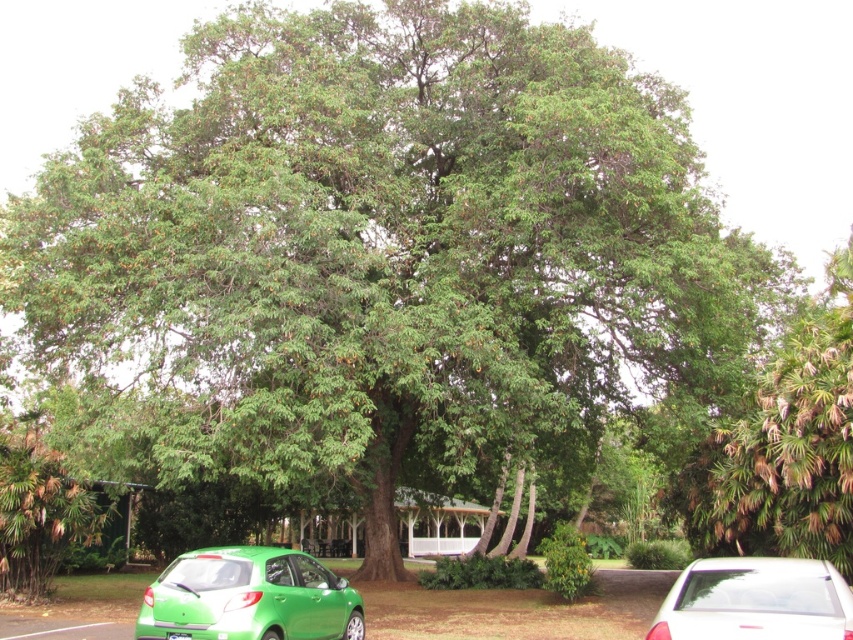
Question: Can you confirm if white glossy sedan at lower right is thinner than green plastic license plate at lower center?

Choices:
 (A) yes
 (B) no

Answer: (B)

Question: Estimate the real-world distances between objects in this image. Which object is farther from the green matte hatchback at lower left?

Choices:
 (A) white glossy sedan at lower right
 (B) green leafy tree at right
 (C) green plastic license plate at lower center
 (D) green leafy tree at lower left

Answer: (B)

Question: Among these objects, which one is nearest to the camera?

Choices:
 (A) green leafy tree at right
 (B) green leafy tree at lower left
 (C) green plastic license plate at lower center

Answer: (C)

Question: Which is nearer to the green leafy tree at lower left?

Choices:
 (A) white glossy sedan at lower right
 (B) green matte hatchback at lower left

Answer: (B)

Question: Is green matte hatchback at lower left smaller than green leafy tree at lower left?

Choices:
 (A) no
 (B) yes

Answer: (B)

Question: Is white glossy sedan at lower right positioned at the back of green leafy tree at lower left?

Choices:
 (A) no
 (B) yes

Answer: (A)